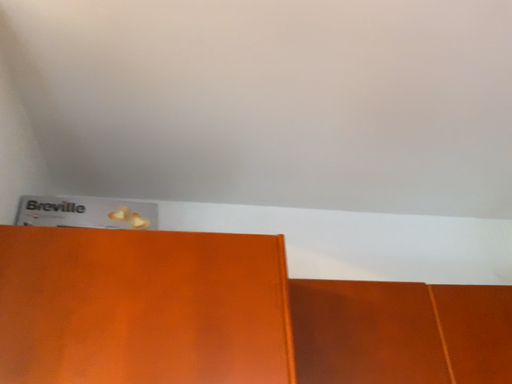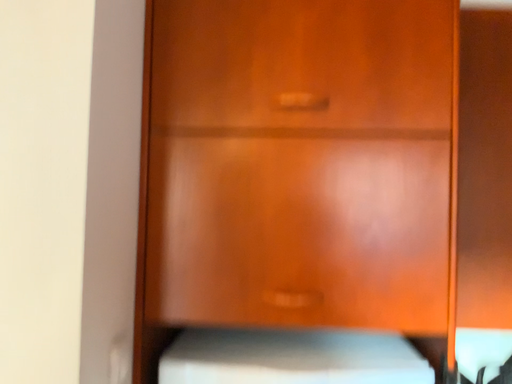
Question: How did the camera likely rotate when shooting the video?

Choices:
 (A) rotated downward
 (B) rotated upward

Answer: (A)